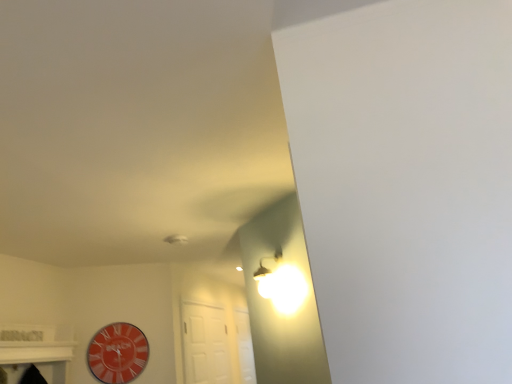
Question: Does point (135, 340) appear closer or farther from the camera than point (190, 365)?

Choices:
 (A) farther
 (B) closer

Answer: (B)

Question: Relative to white matte door at center, is orange glossy clock at lower left in front or behind?

Choices:
 (A) front
 (B) behind

Answer: (A)

Question: Looking at their shapes, would you say orange glossy clock at lower left is wider or thinner than white matte door at center?

Choices:
 (A) thin
 (B) wide

Answer: (A)

Question: Is white matte door at center taller or shorter than orange glossy clock at lower left?

Choices:
 (A) short
 (B) tall

Answer: (B)

Question: Is point (211, 309) positioned closer to the camera than point (92, 347)?

Choices:
 (A) closer
 (B) farther

Answer: (B)

Question: From a real-world perspective, is white matte door at center physically located above or below orange glossy clock at lower left?

Choices:
 (A) below
 (B) above

Answer: (A)

Question: Is white matte door at center in front of or behind orange glossy clock at lower left in the image?

Choices:
 (A) behind
 (B) front

Answer: (A)